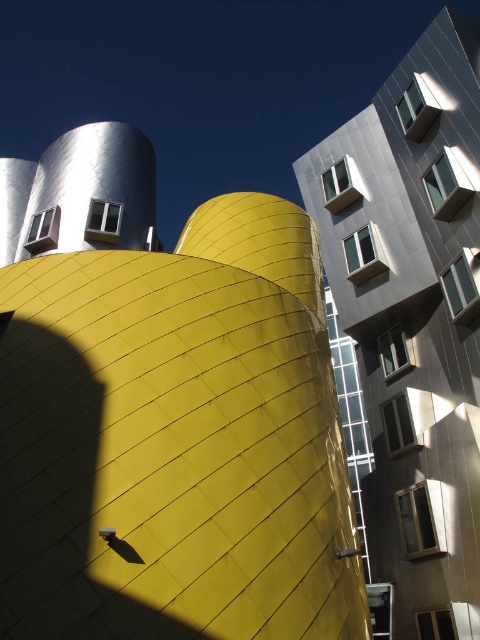
You are an architect analyzing the spatial relationship between the yellow matte building at center and the metallic silver building at upper right. Based on the scene, which building is closer to the observer?

The yellow matte building at center is closer to the observer because it is positioned in front of the metallic silver building at upper right.

You are an architect planning to install solar panels on both the yellow matte building at center and the metallic silver building at upper right. Considering their sizes, which building would require more solar panels to generate the same amount of energy?

The yellow matte building at center requires more solar panels because it is larger in size than the metallic silver building at upper right, so it can accommodate more panels to generate the same energy output.

You are an architect planning to install a solar panel array between the yellow matte building at center and the metallic silver building at upper right. The solar panels require a minimum of 20 meters of space between the two buildings to function optimally. Based on the scene, will the current distance suffice?

The distance between the yellow matte building at center and the metallic silver building at upper right is 17.88 meters, which is less than the required 20 meters. Therefore, the current distance does not suffice for the solar panel array to function optimally.